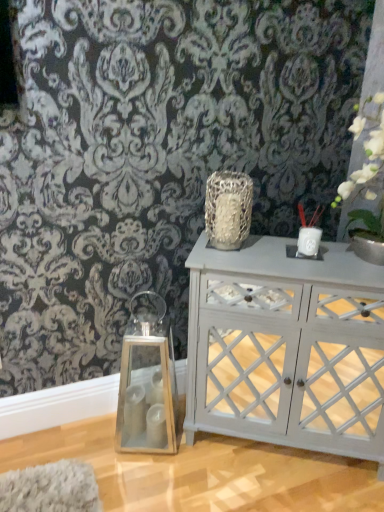
Where is `vacant space underneath white matte vase at upper right (from a real-world perspective)`? The width and height of the screenshot is (384, 512). vacant space underneath white matte vase at upper right (from a real-world perspective) is located at coordinates (355, 258).